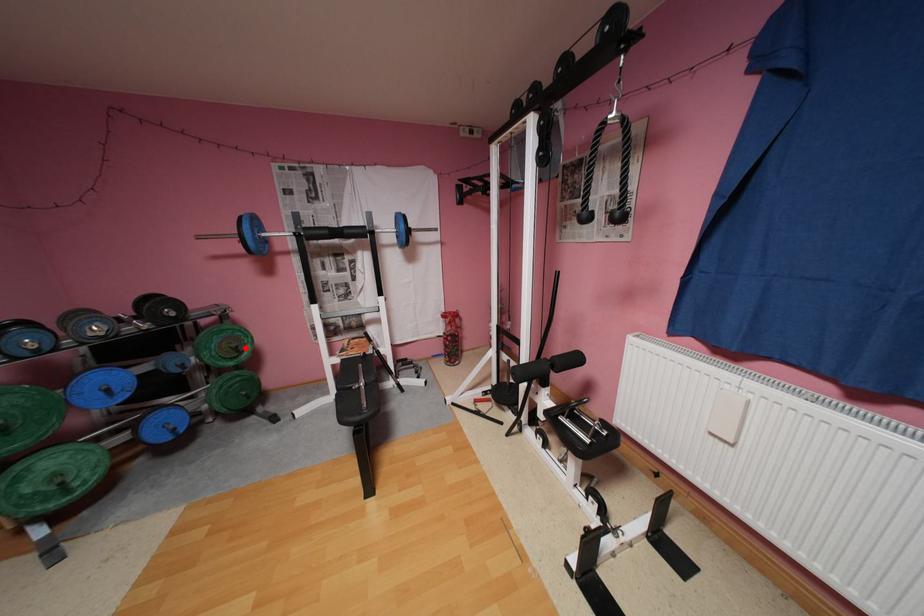
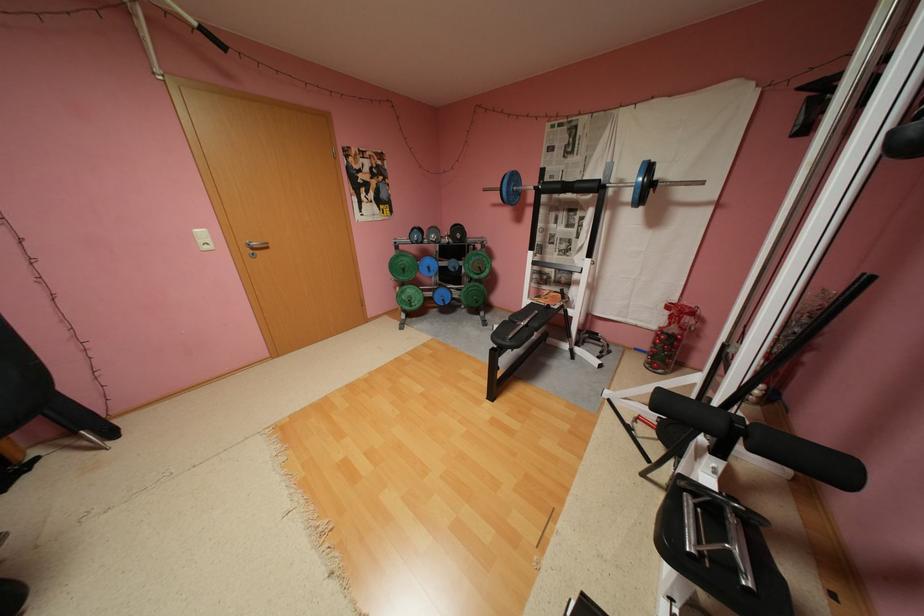
Locate, in the second image, the point that corresponds to the highlighted location in the first image.

(489, 267)